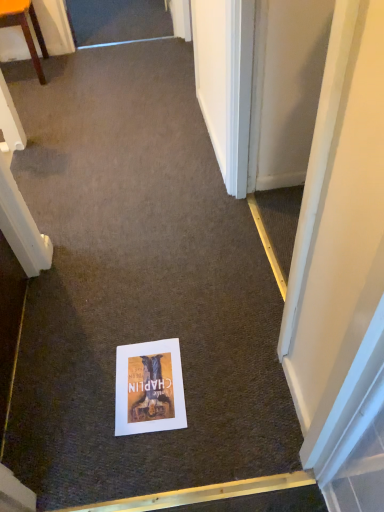
In order to click on vacant area situated to the left side of matte paper poster at center in this screenshot , I will do `click(79, 398)`.